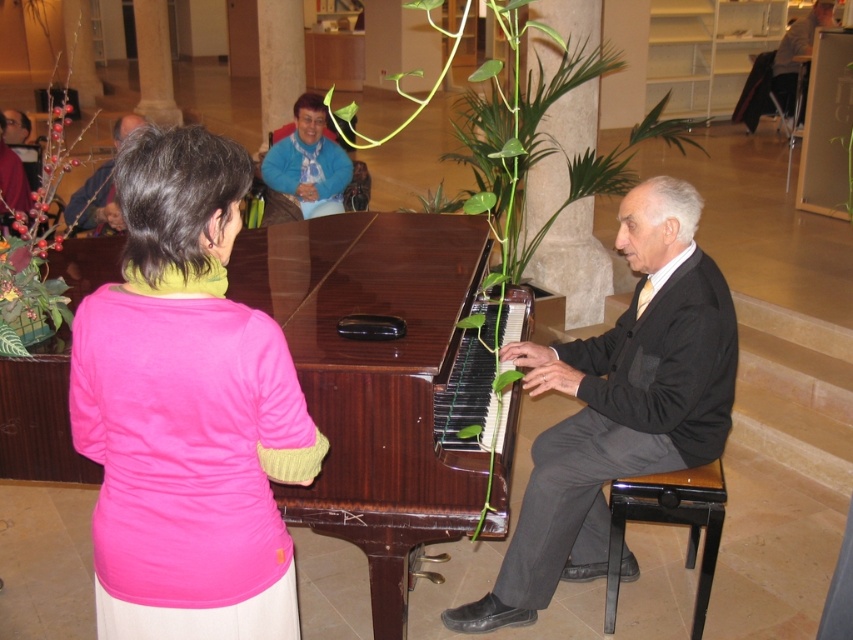
Which of these two, green leafy plant at center or light brown wood chair at upper right, stands taller?

light brown wood chair at upper right

In the scene shown: Who is higher up, green leafy plant at center or light brown wood chair at upper right?

Positioned higher is light brown wood chair at upper right.

Between point (509, 205) and point (780, 67), which one is positioned in front?

Point (509, 205)

Where is `green leafy plant at center`? This screenshot has width=853, height=640. green leafy plant at center is located at coordinates (527, 152).

This screenshot has height=640, width=853. In order to click on matte black piano at center in this screenshot , I will do coord(96,204).

Is matte black piano at center to the right of light brown wood chair at upper right from the viewer's perspective?

No, matte black piano at center is not to the right of light brown wood chair at upper right.

The width and height of the screenshot is (853, 640). Identify the location of matte black piano at center. (96, 204).

The width and height of the screenshot is (853, 640). Describe the element at coordinates (33, 244) in the screenshot. I see `silvery metallic plant at left` at that location.

The image size is (853, 640). What do you see at coordinates (33, 244) in the screenshot?
I see `silvery metallic plant at left` at bounding box center [33, 244].

Find the location of `silvery metallic plant at left`. silvery metallic plant at left is located at coordinates (33, 244).